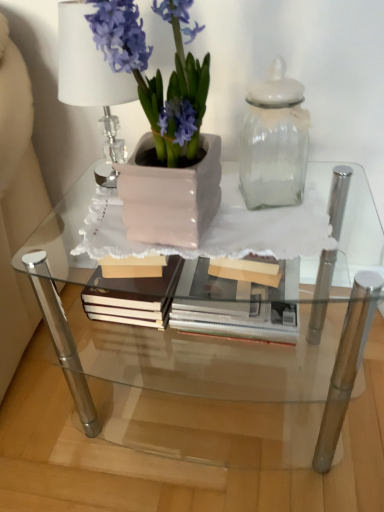
Find the location of `free space above clear glass table at center (from a real-world perspective)`. free space above clear glass table at center (from a real-world perspective) is located at coordinates (219, 219).